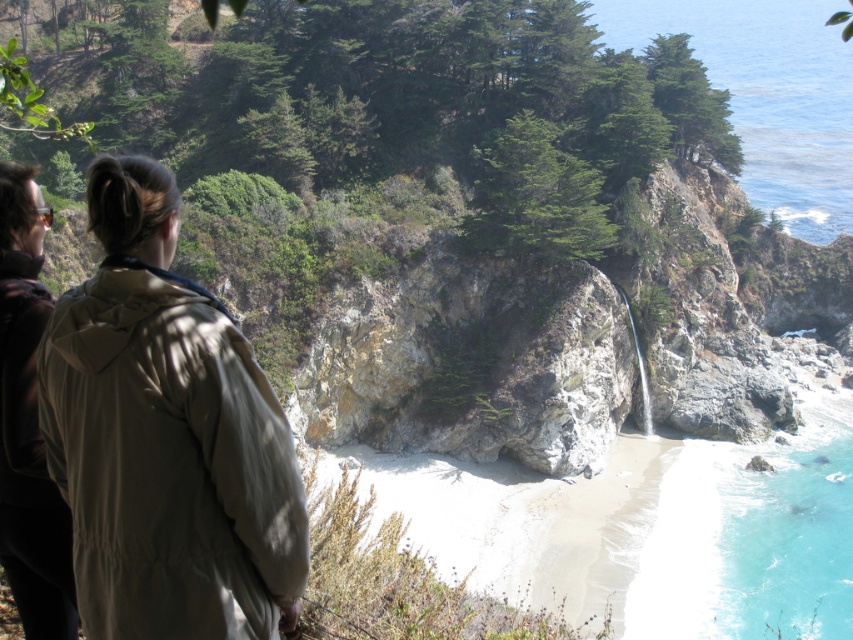
You are a hiker standing on the cliff and want to take a photo of both the beige fabric jacket at left and the turquoise liquid at lower right. Which object should you focus on first to ensure both are in clear view?

You should focus on the beige fabric jacket at left first because it is closer to you than the turquoise liquid at lower right, ensuring both are in focus when using a camera with depth of field considerations.

You are a hiker trying to decide which jacket to wear for a hike on a rocky cliffside with a waterfall. The beige fabric jacket at left and the dark brown leather jacket at left are options. Which jacket is shorter in height?

The beige fabric jacket at left is not as tall as the dark brown leather jacket at left, so the beige fabric jacket at left is shorter in height.